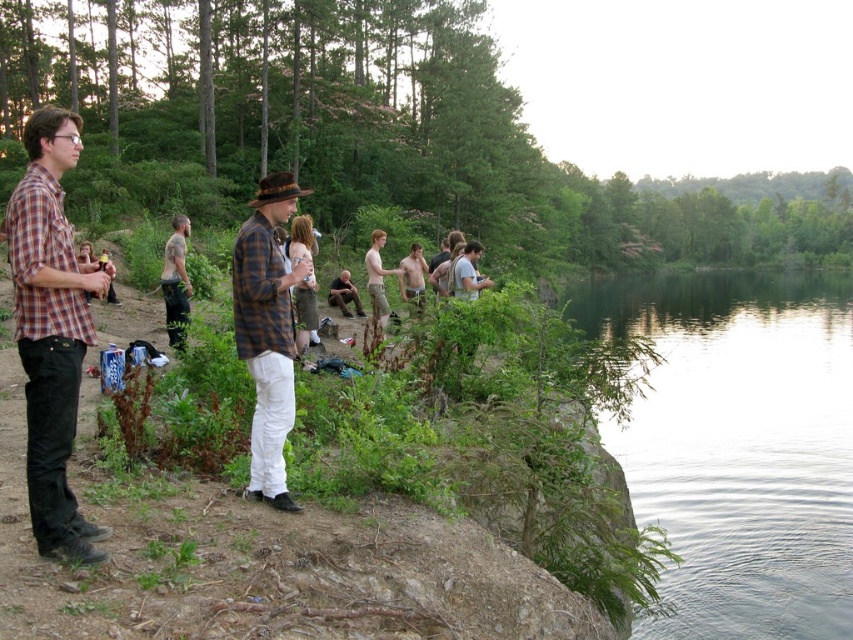
Question: Is brown felt cowboy hat at center below brown leather jacket at center?

Choices:
 (A) yes
 (B) no

Answer: (B)

Question: Which of these objects is positioned closest to the green smooth water at lower right?

Choices:
 (A) matte plaid shirt at left
 (B) plaid fabric shirt at center

Answer: (B)

Question: Is plaid fabric shirt at center above light brown cotton shorts at center?

Choices:
 (A) no
 (B) yes

Answer: (A)

Question: In this image, where is light brown cotton shorts at center located relative to brown felt cowboy hat at center?

Choices:
 (A) below
 (B) above

Answer: (A)

Question: Which of the following is the closest to the observer?

Choices:
 (A) matte plaid shirt at left
 (B) light brown leather pants at center

Answer: (A)

Question: Among these points, which one is nearest to the camera?

Choices:
 (A) [268, 182]
 (B) [380, 246]
 (C) [294, 188]

Answer: (C)